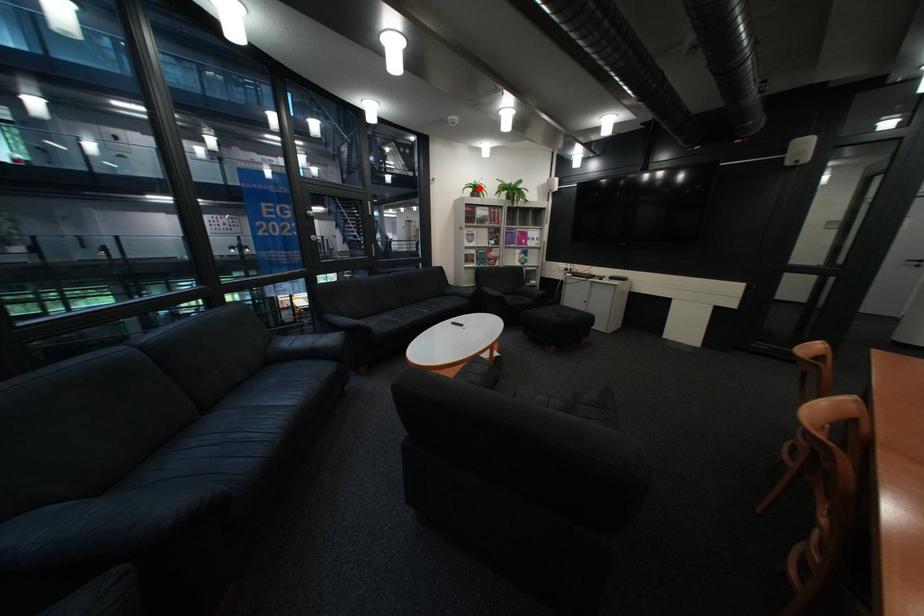
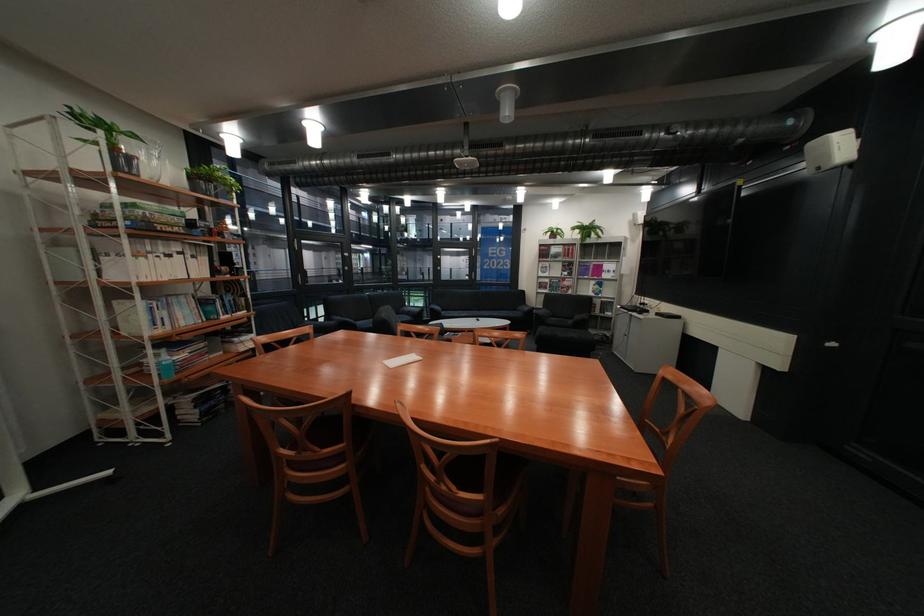
Locate, in the second image, the point that corresponds to the highlighted location in the first image.

(562, 233)